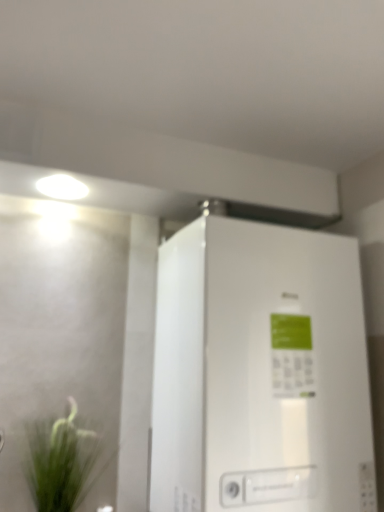
What is the approximate height of green grass at lower left?

It is 36.31 centimeters.

The image size is (384, 512). Describe the element at coordinates (62, 461) in the screenshot. I see `green grass at lower left` at that location.

Where is `green grass at lower left`? The width and height of the screenshot is (384, 512). green grass at lower left is located at coordinates (62, 461).

Measure the distance between white glossy refrigerator at center and camera.

They are 3.79 feet apart.

Describe the element at coordinates (260, 372) in the screenshot. I see `white glossy refrigerator at center` at that location.

The width and height of the screenshot is (384, 512). Find the location of `white glossy refrigerator at center`. white glossy refrigerator at center is located at coordinates (260, 372).

This screenshot has width=384, height=512. In order to click on green grass at lower left in this screenshot , I will do `click(62, 461)`.

Which is more to the right, white glossy refrigerator at center or green grass at lower left?

Positioned to the right is white glossy refrigerator at center.

From the picture: Between white glossy refrigerator at center and green grass at lower left, which one is positioned behind?

green grass at lower left.

Considering the points (367, 421) and (113, 453), which point is in front, point (367, 421) or point (113, 453)?

The point (367, 421) is more forward.

From the image's perspective, which one is positioned lower, white glossy refrigerator at center or green grass at lower left?

green grass at lower left, from the image's perspective.

From a real-world perspective, which is physically above, white glossy refrigerator at center or green grass at lower left?

white glossy refrigerator at center.

Is white glossy refrigerator at center wider or thinner than green grass at lower left?

white glossy refrigerator at center is wider than green grass at lower left.

Which of these two, white glossy refrigerator at center or green grass at lower left, stands shorter?

green grass at lower left is shorter.

Between white glossy refrigerator at center and green grass at lower left, which one has smaller size?

Smaller between the two is green grass at lower left.

Is white glossy refrigerator at center spatially inside green grass at lower left, or outside of it?

white glossy refrigerator at center is spatially situated outside green grass at lower left.

Are white glossy refrigerator at center and green grass at lower left located far from each other?

That's not correct — white glossy refrigerator at center is a little close to green grass at lower left.

Is white glossy refrigerator at center oriented away from green grass at lower left?

No, white glossy refrigerator at center is not facing away from green grass at lower left.

What's the angular difference between white glossy refrigerator at center and green grass at lower left's facing directions?

There is a 0.526-degree angle between the facing directions of white glossy refrigerator at center and green grass at lower left.

You are a GUI agent. You are given a task and a screenshot of the screen. Output one action in this format:
    pyautogui.click(x=<x>, y=<y>)
    Task: Click on the houseplant behind the white glossy refrigerator at center
    
    Given the screenshot: What is the action you would take?
    pyautogui.click(x=62, y=461)

From the picture: Does green grass at lower left appear on the left side of white glossy refrigerator at center?

Indeed, green grass at lower left is positioned on the left side of white glossy refrigerator at center.

Is green grass at lower left further to the viewer compared to white glossy refrigerator at center?

Yes, green grass at lower left is further from the viewer.

Is point (71, 498) farther from camera compared to point (354, 449)?

No, (71, 498) is in front of (354, 449).

From the image's perspective, is green grass at lower left positioned above or below white glossy refrigerator at center?

green grass at lower left is situated lower than white glossy refrigerator at center in the image.

Looking at this image, from a real-world perspective, between green grass at lower left and white glossy refrigerator at center, who is vertically lower?

green grass at lower left is physically lower.

Looking at their sizes, would you say green grass at lower left is wider or thinner than white glossy refrigerator at center?

green grass at lower left is thinner than white glossy refrigerator at center.

Can you confirm if green grass at lower left is shorter than white glossy refrigerator at center?

Yes.

Considering the sizes of objects green grass at lower left and white glossy refrigerator at center in the image provided, who is smaller, green grass at lower left or white glossy refrigerator at center?

With smaller size is green grass at lower left.

Is green grass at lower left completely or partially outside of white glossy refrigerator at center?

Yes.

Would you say green grass at lower left is a long distance from white glossy refrigerator at center?

green grass at lower left is actually quite close to white glossy refrigerator at center.

Consider the image. Is green grass at lower left oriented away from white glossy refrigerator at center?

No, green grass at lower left is not facing away from white glossy refrigerator at center.

How many degrees apart are the facing directions of green grass at lower left and white glossy refrigerator at center?

0.526 degrees.

How much distance is there between green grass at lower left and white glossy refrigerator at center?

A distance of 21.52 inches exists between green grass at lower left and white glossy refrigerator at center.

The image size is (384, 512). What are the coordinates of `refrigerator above the green grass at lower left (from a real-world perspective)` in the screenshot? It's located at (260, 372).

Identify the location of houseplant located below the white glossy refrigerator at center (from the image's perspective). (62, 461).

Where is `refrigerator positioned vertically above the green grass at lower left (from a real-world perspective)`? refrigerator positioned vertically above the green grass at lower left (from a real-world perspective) is located at coordinates (260, 372).